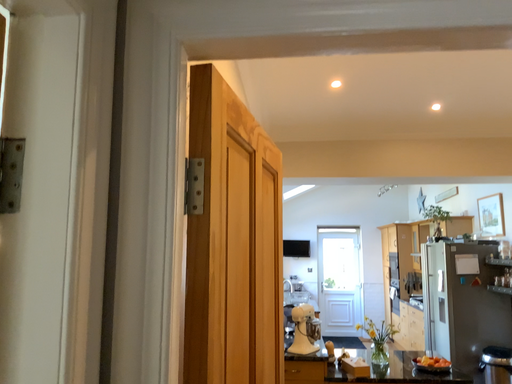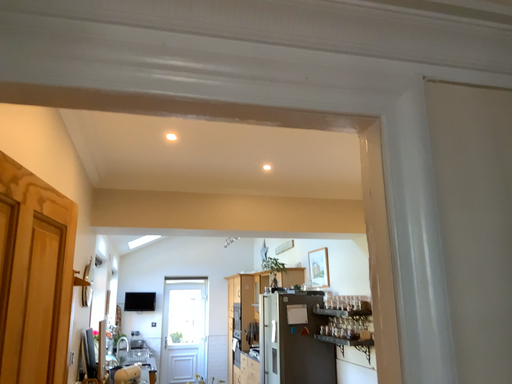
Question: Which way did the camera rotate in the video?

Choices:
 (A) rotated right
 (B) rotated left

Answer: (A)